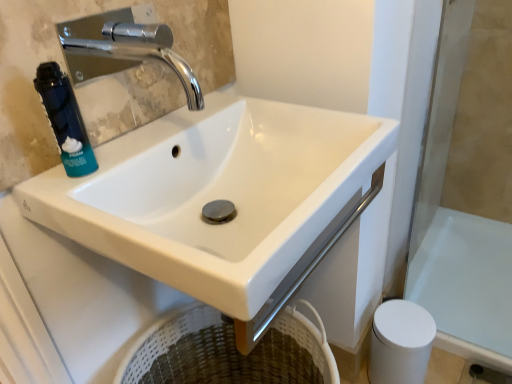
Where is `free point below chrome metallic faucet at upper left (from a real-world perspective)`? The width and height of the screenshot is (512, 384). free point below chrome metallic faucet at upper left (from a real-world perspective) is located at coordinates (155, 136).